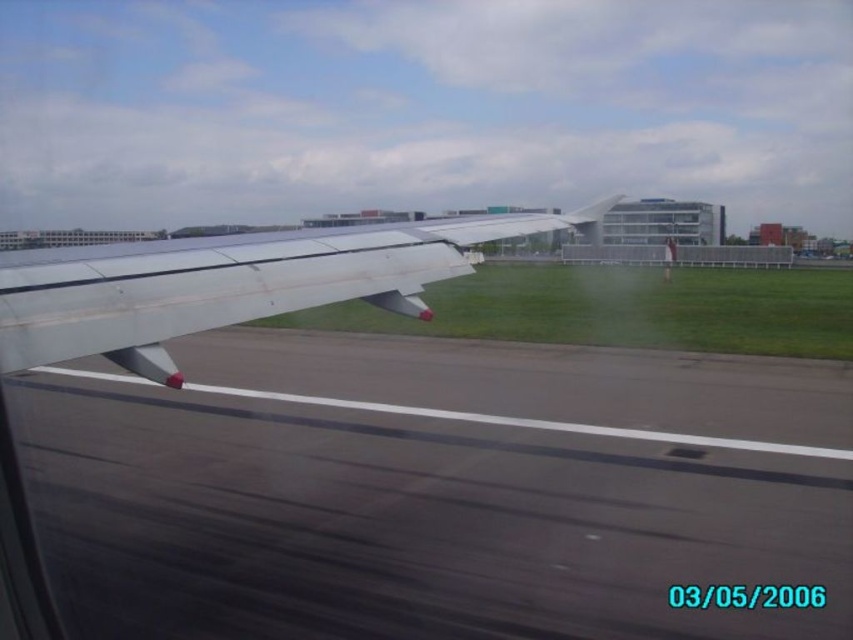
You are a pilot preparing for takeoff and you notice two objects in your view from the cockpit window. You see the gray asphalt runway at lower left and the metallic silver wing at left. Which of these two objects is positioned more to the left side of your view?

The gray asphalt runway at lower left is positioned to the left of the metallic silver wing at left, so the gray asphalt runway at lower left is more to the left side of your view.

You are a pilot sitting in the cockpit of the aircraft. You notice a point marked at coordinates (434, 490) on your window. Based on the scene, what does this point likely represent?

The point at coordinates (434, 490) corresponds to the gray asphalt runway at lower left.

You are a pilot preparing for takeoff and notice the gray asphalt runway at lower left and the metallic silver wing at left. Which object is positioned lower in the image from your viewpoint?

The gray asphalt runway at lower left is located below the metallic silver wing at left, so it is positioned lower in the image from your viewpoint.